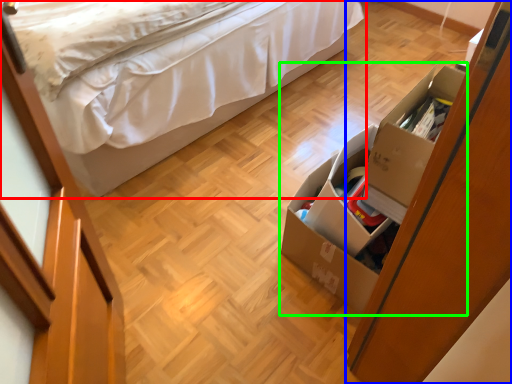
Question: Based on their relative distances, which object is farther from bed (highlighted by a red box)? Choose from dresser (highlighted by a blue box) and storage box (highlighted by a green box).

Choices:
 (A) dresser
 (B) storage box

Answer: (A)